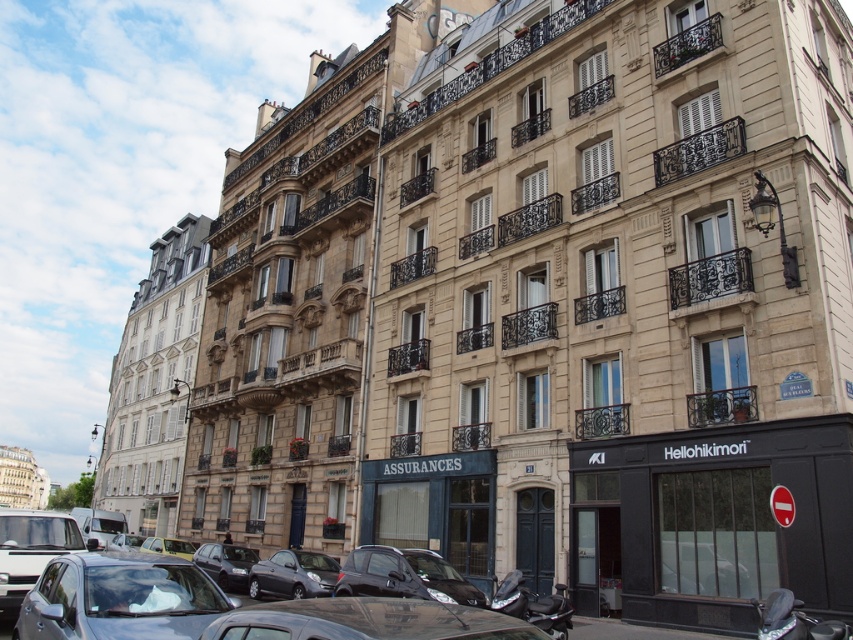
You are standing at the point marked by the coordinate point at (154,385) in the image. What type of building are you in front of?

The point at (154,385) marks a beige stone building at left, so you are in front of a beige stone building at left.

You are a delivery driver who needs to park your 1.8 meters wide truck between two parked cars in the street. The two cars are a metallic gray hatchback at center and a shiny black sedan at center. Which car should you position your truck next to so that it fits without overlapping either vehicle?

The metallic gray hatchback at center has a larger width than the shiny black sedan at center. Therefore, positioning the truck next to the metallic gray hatchback at center would provide enough space for the 1.8 meters wide truck to fit without overlapping.